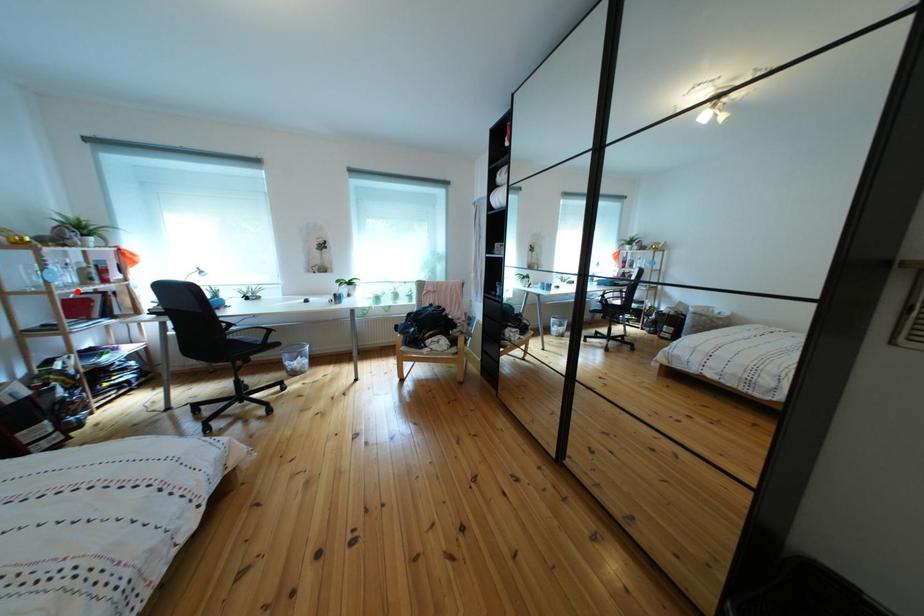
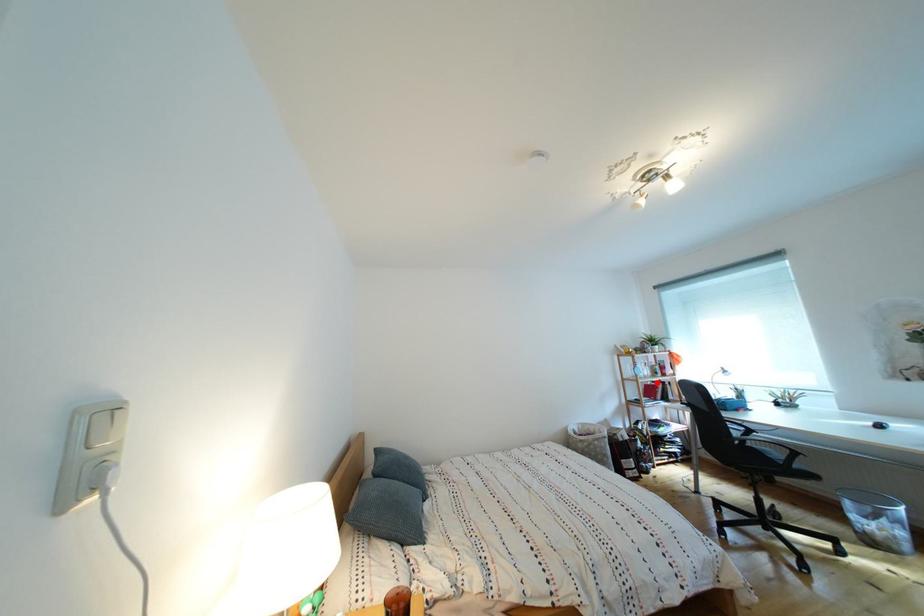
I am providing you with two images of the same scene from different viewpoints. A red point is marked on the first image and another point is marked on the second image. Do the highlighted points in image1 and image2 indicate the same real-world spot?

Yes